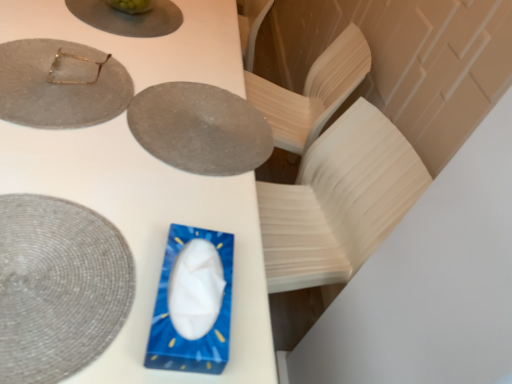
You are a GUI agent. You are given a task and a screenshot of the screen. Output one action in this format:
    pyautogui.click(x=<x>, y=<y>)
    Task: Click on the vacant area situated below matte gray placemat at lower left, marked as the first plate in a bottom-to-top arrangement (from a real-world perspective)
    Image resolution: width=512 pixels, height=384 pixels.
    Given the screenshot: What is the action you would take?
    pyautogui.click(x=54, y=275)